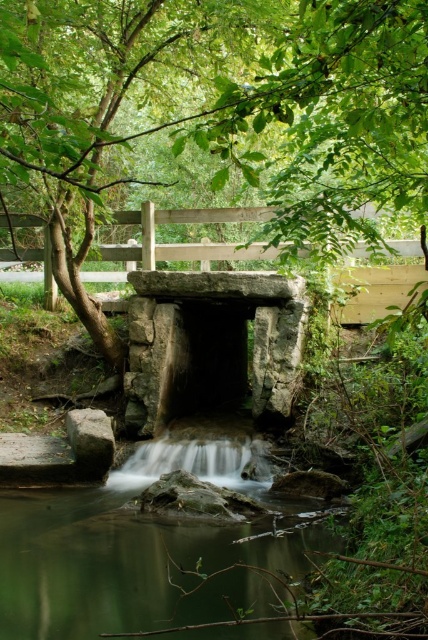
Question: Does green leafy tree at center have a greater width compared to green translucent water at center?

Choices:
 (A) no
 (B) yes

Answer: (B)

Question: Can you confirm if green leafy tree at center is bigger than green translucent water at center?

Choices:
 (A) yes
 (B) no

Answer: (A)

Question: Which of the following is the farthest from the observer?

Choices:
 (A) (42, 490)
 (B) (163, 461)

Answer: (B)

Question: Estimate the real-world distances between objects in this image. Which object is farther from the green translucent water at center?

Choices:
 (A) green leafy tree at center
 (B) smooth gray stone waterfall at center

Answer: (A)

Question: Observing the image, what is the correct spatial positioning of green leafy tree at center in reference to smooth gray stone waterfall at center?

Choices:
 (A) left
 (B) right

Answer: (A)

Question: Which point is closer to the camera?

Choices:
 (A) (x=332, y=99)
 (B) (x=139, y=460)

Answer: (A)